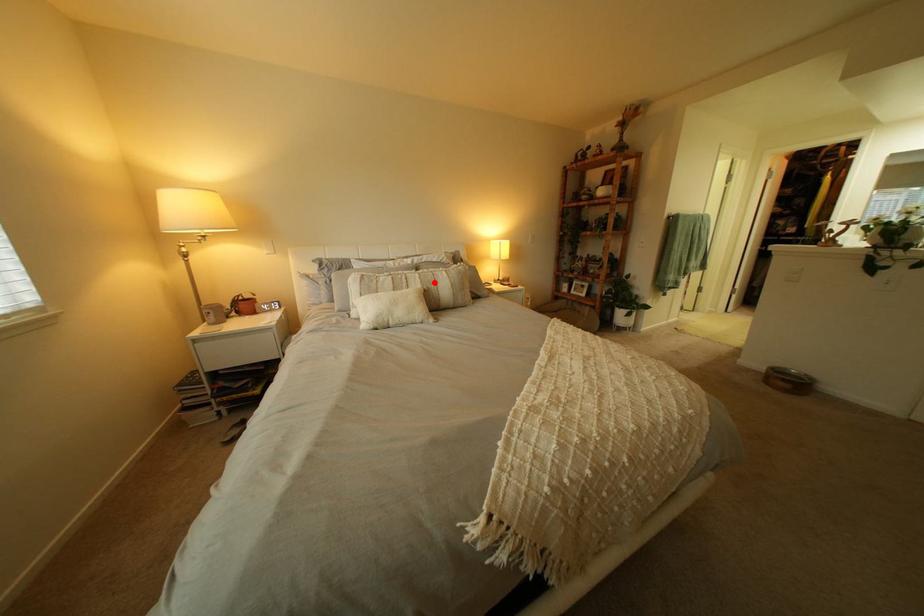
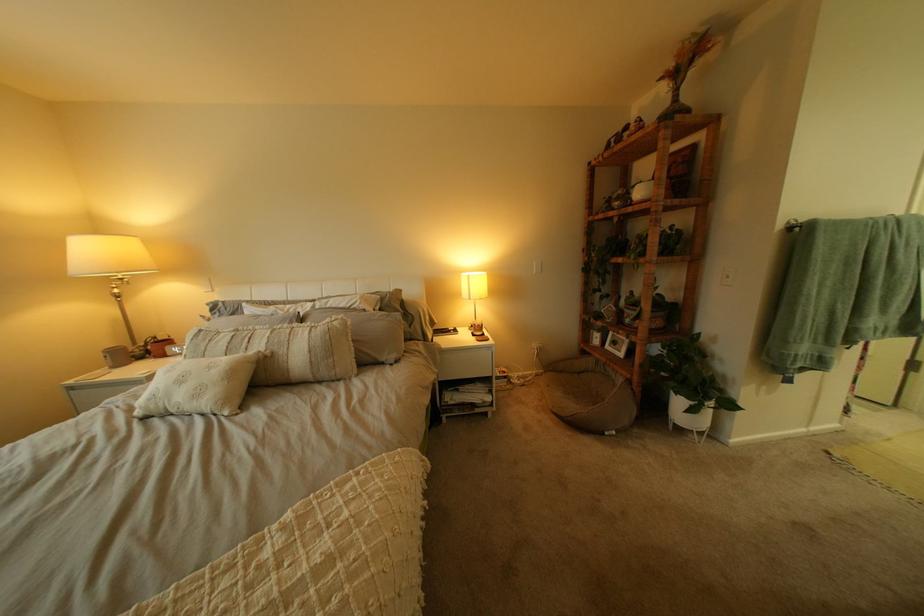
Locate, in the second image, the point that corresponds to the highlighted location in the first image.

(281, 342)